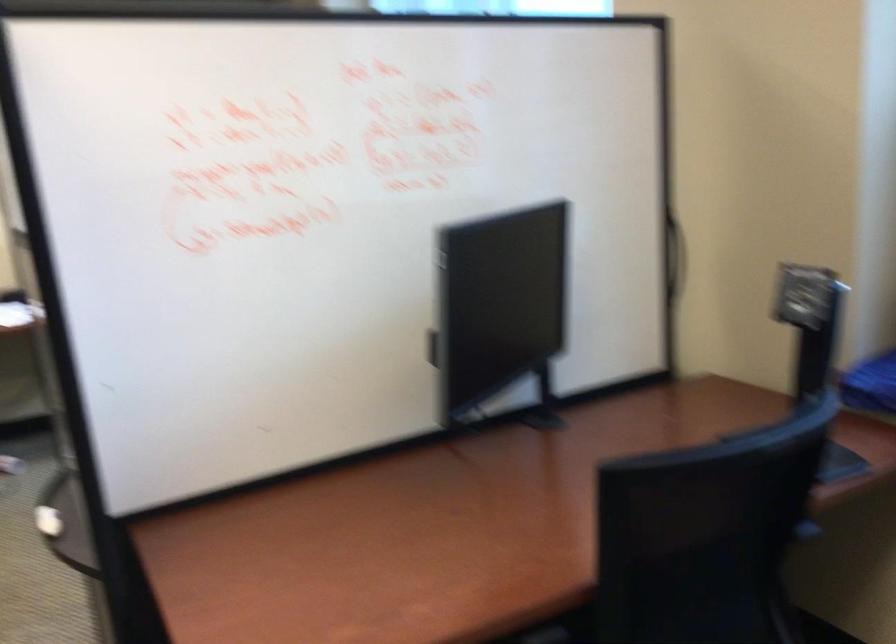
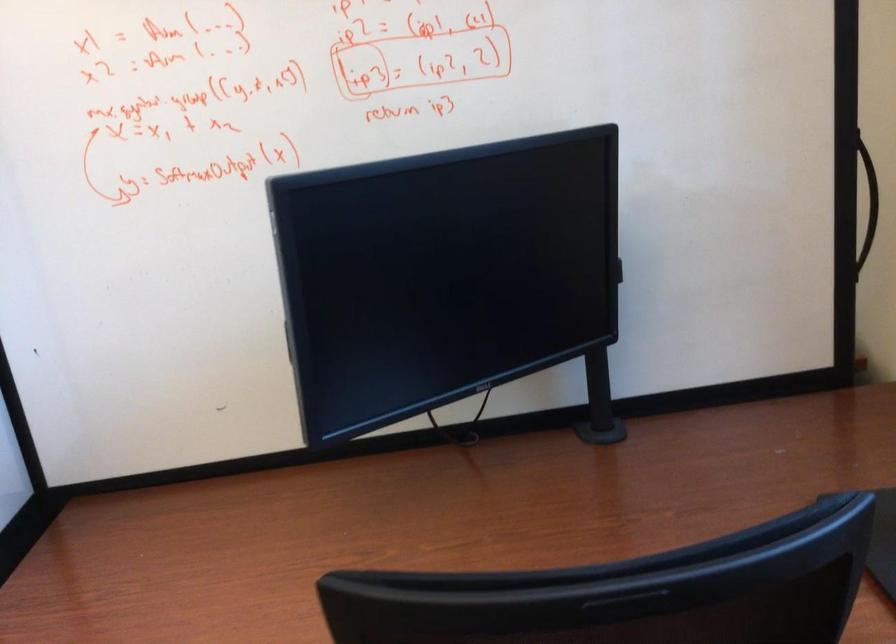
Question: The camera is either moving clockwise (left) or counter-clockwise (right) around the object. The first image is from the beginning of the video and the second image is from the end. Is the camera moving left or right when shooting the video?

Choices:
 (A) Left
 (B) Right

Answer: (B)